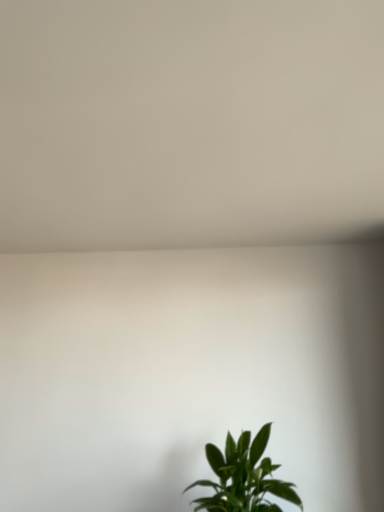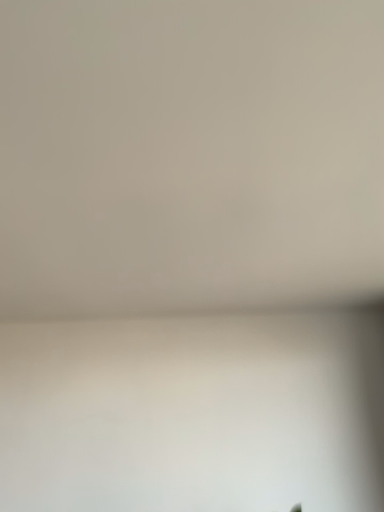
Question: Which way did the camera rotate in the video?

Choices:
 (A) rotated downward
 (B) rotated upward

Answer: (B)